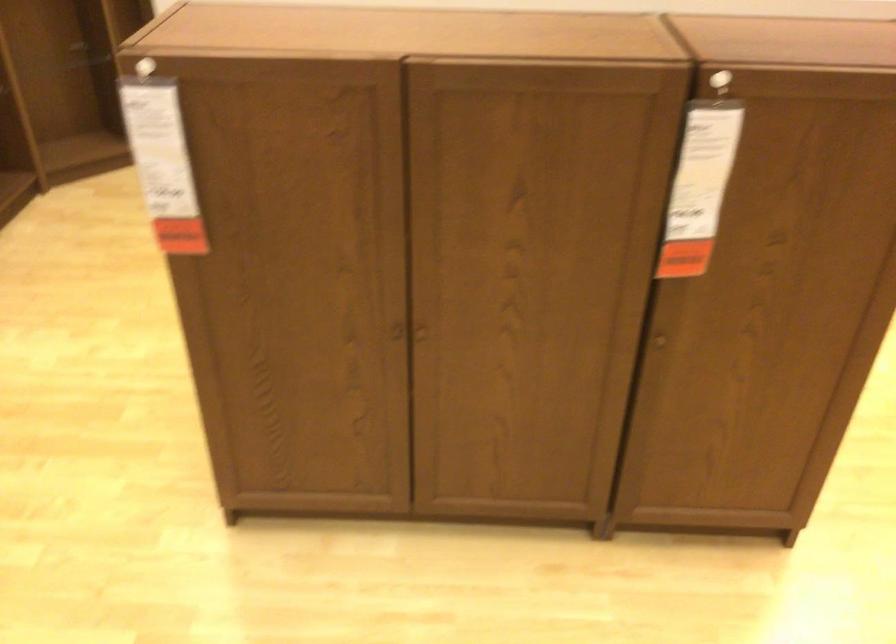
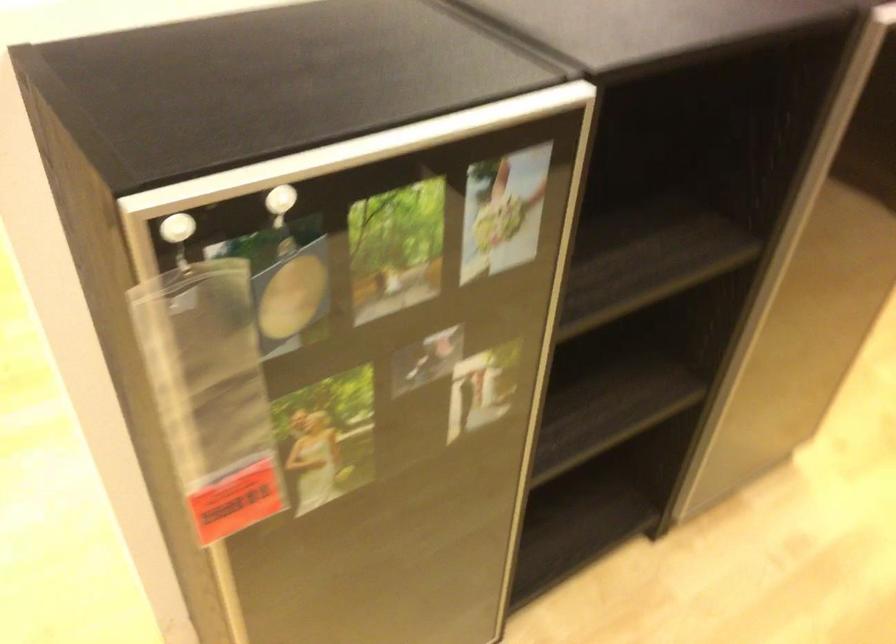
Question: I am providing you with two images of the same scene from different viewpoints. Please identify which objects are invisible in image2.

Choices:
 (A) clear plastic pouch
 (B) silver door frame
 (C) small cabinet knob
 (D) black sheathed sword

Answer: (C)